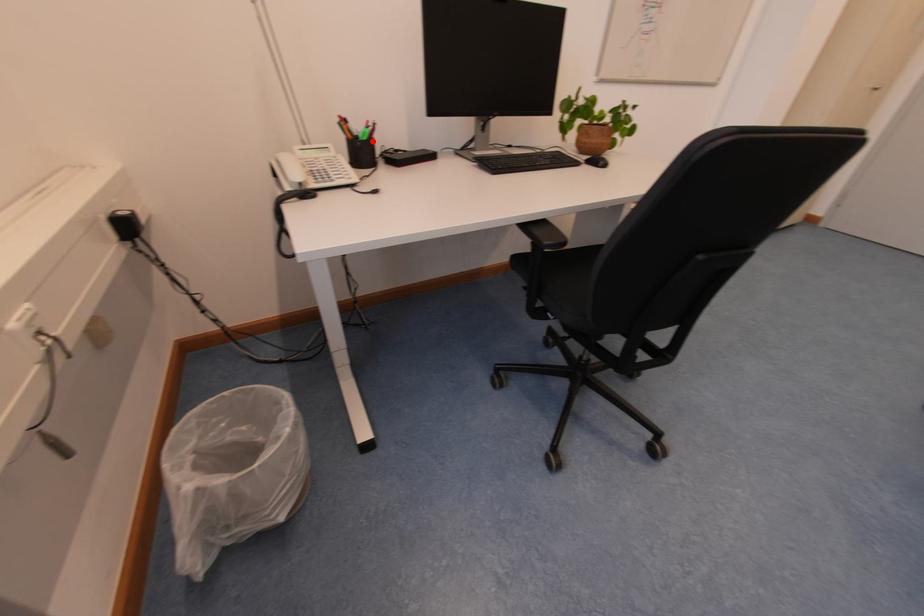
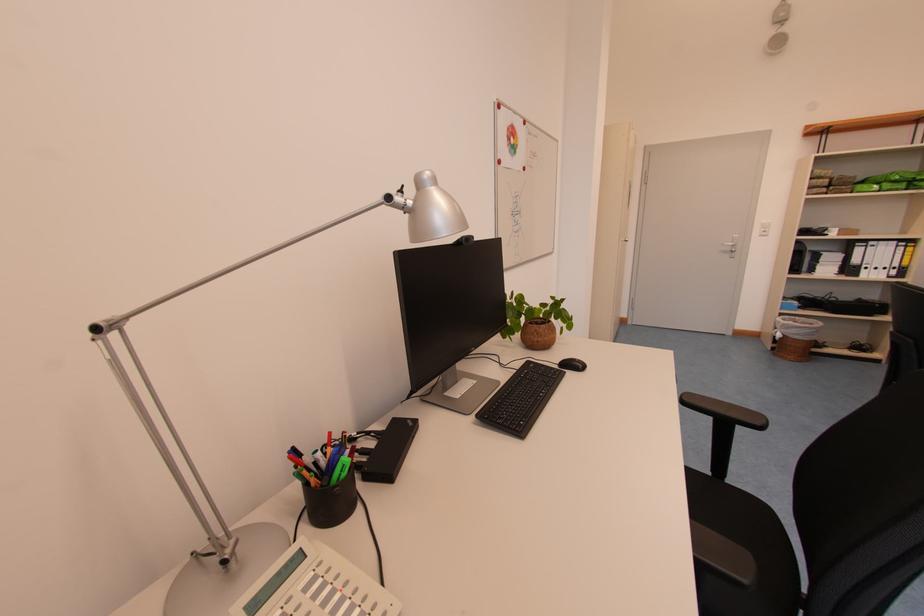
Find the pixel in the second image that matches the highlighted location in the first image.

(351, 477)